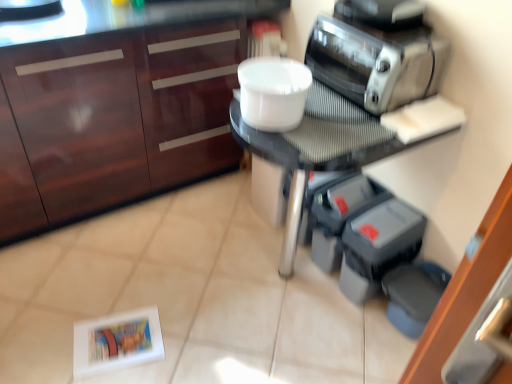
Find the location of `vacant area in front of gray rubber dumbbells at lower right, arranged as the 2th appliance when viewed from the left`. vacant area in front of gray rubber dumbbells at lower right, arranged as the 2th appliance when viewed from the left is located at coordinates (354, 334).